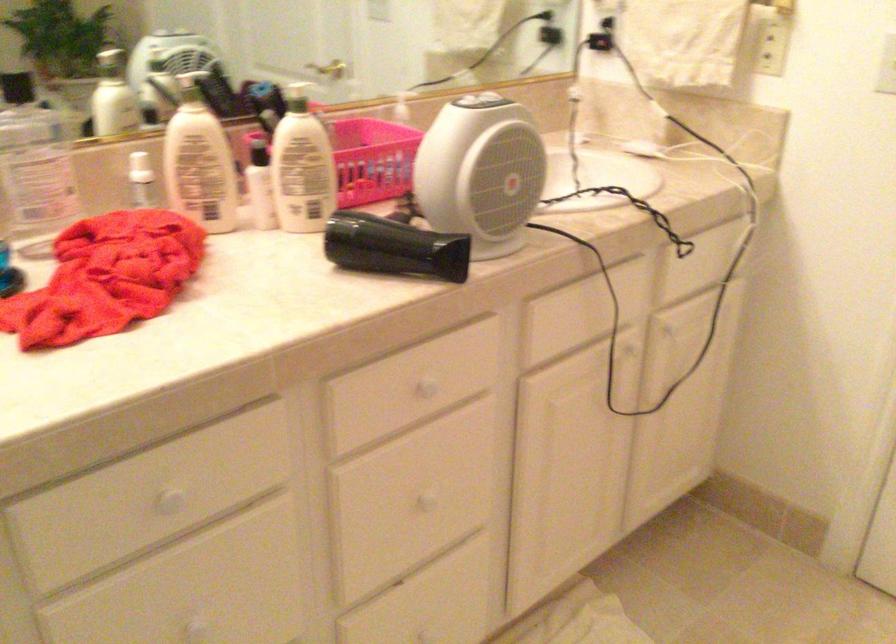
The image size is (896, 644). What do you see at coordinates (329, 69) in the screenshot?
I see `a faucet handle` at bounding box center [329, 69].